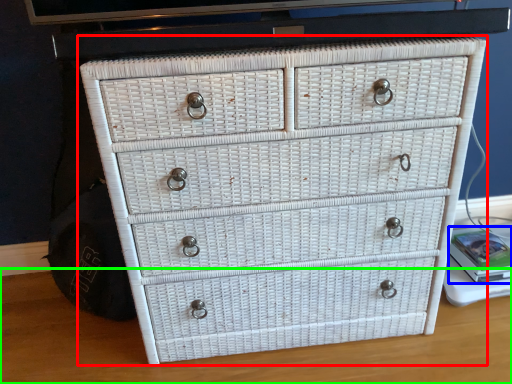
Question: Considering the real-world distances, which object is farthest from chest of drawers (highlighted by a red box)? book (highlighted by a blue box) or table top (highlighted by a green box)?

Choices:
 (A) book
 (B) table top

Answer: (A)